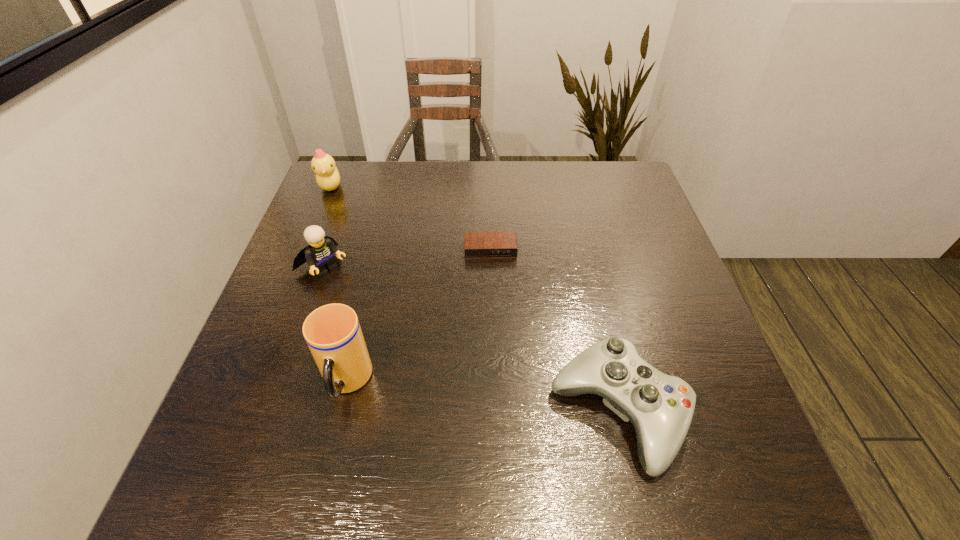
Where is `the tallest object`? This screenshot has height=540, width=960. the tallest object is located at coordinates (332, 332).

At what (x,y) coordinates should I click in order to perform the action: click on cup. Please return your answer as a coordinate pair (x, y). This screenshot has height=540, width=960. Looking at the image, I should click on (332, 332).

Where is `control`? The width and height of the screenshot is (960, 540). control is located at coordinates (660, 407).

Image resolution: width=960 pixels, height=540 pixels. In order to click on the rightmost object in this screenshot , I will do `click(660, 407)`.

Find the location of a particular element. Image resolution: width=960 pixels, height=540 pixels. the farthest object is located at coordinates (327, 175).

The width and height of the screenshot is (960, 540). Find the location of `Lego`. Lego is located at coordinates (319, 254).

Identify the location of alarm clock. coord(483,244).

You are a GUI agent. You are given a task and a screenshot of the screen. Output one action in this format:
    pyautogui.click(x=<x>, y=<y>)
    Task: Click on the fourth object from left to right
    
    Given the screenshot: What is the action you would take?
    pyautogui.click(x=483, y=244)

In order to click on vacant area located on the right of the fourth tallest object in this screenshot , I will do `click(721, 413)`.

Find the location of a particular element. The width and height of the screenshot is (960, 540). vacant space located 0.280m on the front-facing side of the farthest object is located at coordinates (377, 250).